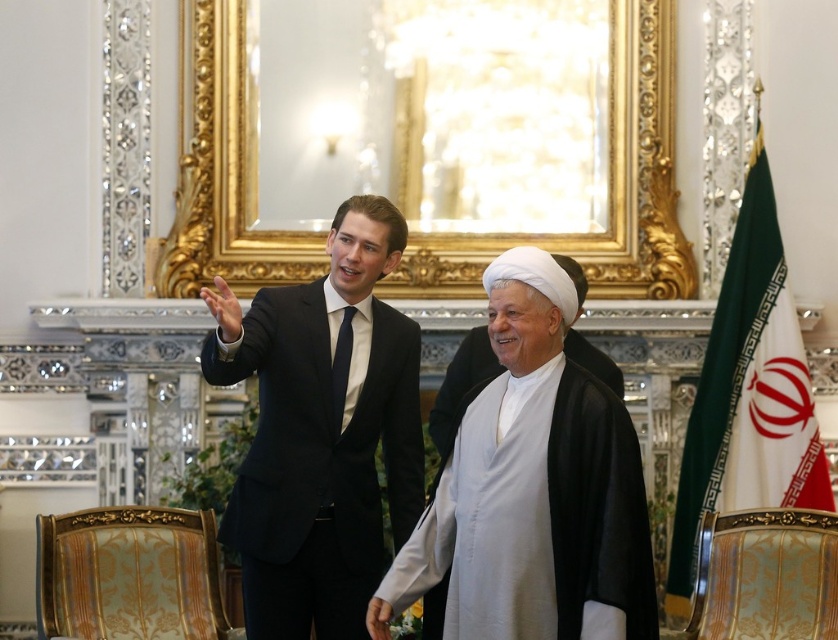
You are an event organizer arranging seating for a diplomatic meeting. You have two chairs available, one that can accommodate a larger person and another for a smaller one. Given the image, which chair should the person in the matte black suit at center and the white matte robe at center sit in?

The matte black suit at center is larger in size than the white matte robe at center, so the person in the matte black suit at center should sit in the chair for larger persons, while the person in the white matte robe at center should use the smaller chair.

You are an event photographer in this grand room. You need to capture a clear photo of both the matte black suit at center and the white matte robe at center. Based on their positions, which one is more likely to be in focus if you focus on the center of the image?

The matte black suit at center is positioned over the white matte robe at center, so focusing on the center would primarily capture the matte black suit at center in focus, with the white matte robe at center possibly appearing blurred if it is behind.

You are standing at the point with coordinates point [593,502] and want to walk to the point with coordinates point [236,376]. Which direction should you move?

To move from point [593,502] to point [236,376], you should move towards the upper left direction since point [236,376] is behind point [593,502].